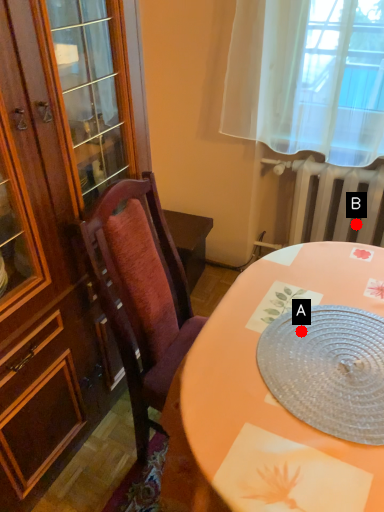
Question: Two points are circled on the image, labeled by A and B beside each circle. Which point is farther to the camera?

Choices:
 (A) A is further
 (B) B is further

Answer: (B)